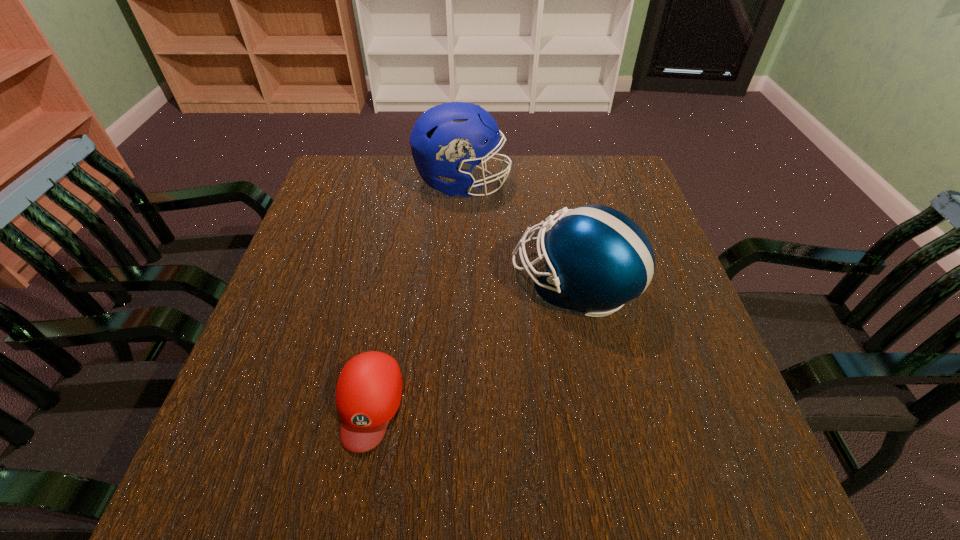
Image resolution: width=960 pixels, height=540 pixels. Identify the location of object at the right edge. (597, 258).

In the image, there is a desktop. Where is `blank space at the far edge`? This screenshot has width=960, height=540. blank space at the far edge is located at coordinates (493, 202).

Where is `free space at the left edge of the desktop`? This screenshot has height=540, width=960. free space at the left edge of the desktop is located at coordinates (319, 313).

Image resolution: width=960 pixels, height=540 pixels. In the image, there is a desktop. Identify the location of vacant space at the right edge. (685, 409).

The height and width of the screenshot is (540, 960). Find the location of `vacant space at the far right corner of the desktop`. vacant space at the far right corner of the desktop is located at coordinates (610, 184).

The image size is (960, 540). I want to click on free spot between the farthest object and the nearest object, so click(x=416, y=294).

Where is `vacant space in between the nearer football helmet and the farther football helmet`? The image size is (960, 540). vacant space in between the nearer football helmet and the farther football helmet is located at coordinates (518, 235).

Find the location of a particular element. The image size is (960, 540). free spot between the farthest object and the baseball cap is located at coordinates (416, 294).

Find the location of a particular element. This screenshot has height=540, width=960. vacant area that lies between the nearer football helmet and the nearest object is located at coordinates (471, 344).

Where is `vacant space that's between the farthest object and the baseball cap`? vacant space that's between the farthest object and the baseball cap is located at coordinates (416, 294).